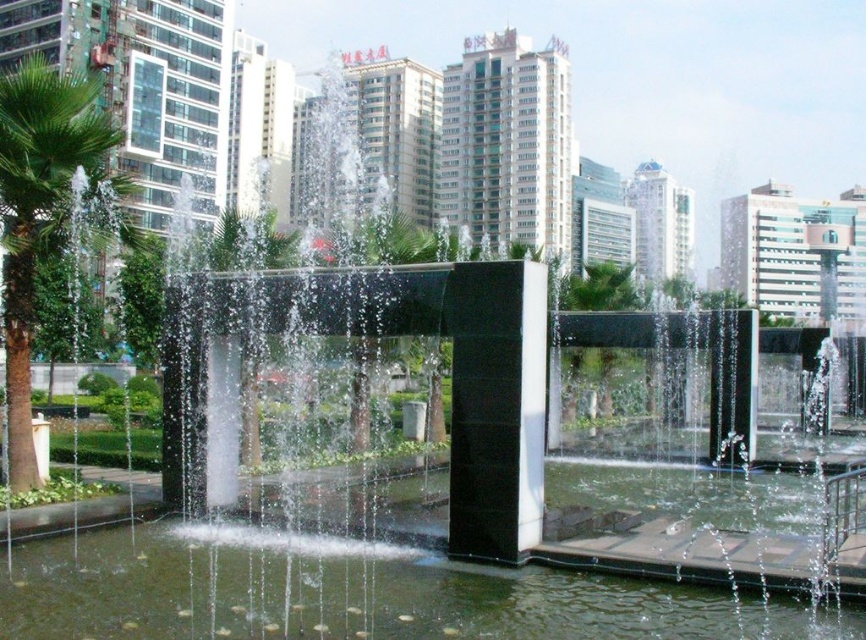
Question: Which point is farther to the camera?

Choices:
 (A) green leafy palm tree at left
 (B) clear water at center

Answer: (A)

Question: Observing the image, what is the correct spatial positioning of clear water at center in reference to green leafy palm tree at left?

Choices:
 (A) right
 (B) left

Answer: (A)

Question: Can you confirm if clear water at center is smaller than green leafy palm tree at left?

Choices:
 (A) no
 (B) yes

Answer: (B)

Question: Which point is closer to the camera taking this photo?

Choices:
 (A) (734, 616)
 (B) (98, 125)

Answer: (A)

Question: Is clear water at center positioned before green leafy palm tree at left?

Choices:
 (A) yes
 (B) no

Answer: (A)